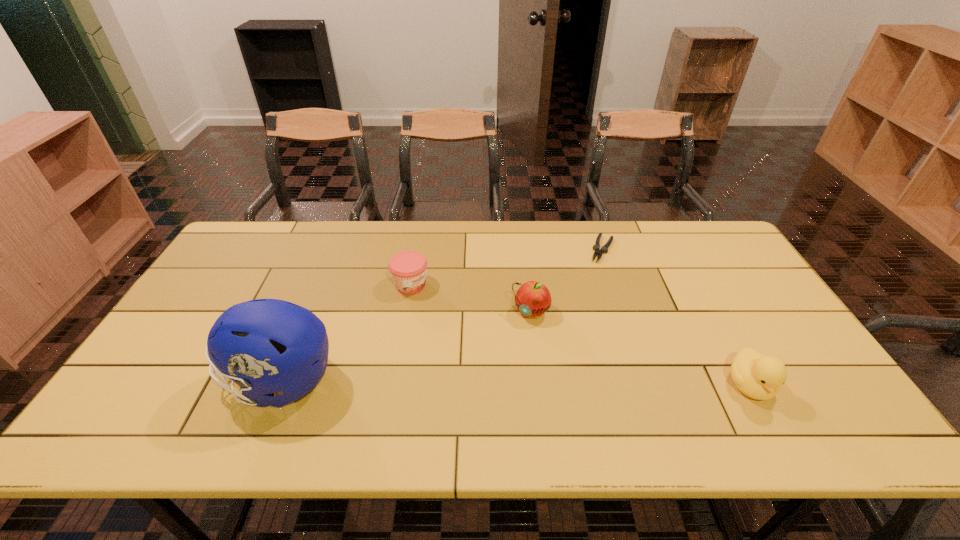
This screenshot has width=960, height=540. In order to click on free region located on the front-facing side of the football helmet in this screenshot , I will do `click(185, 381)`.

Identify the location of blank area located on the front-facing side of the football helmet. This screenshot has height=540, width=960. (194, 381).

Locate an element on the screen. The image size is (960, 540). free space located at the gripping part of the fourth object from left to right is located at coordinates (596, 273).

This screenshot has width=960, height=540. What are the coordinates of `vacant space located 0.160m at the gripping part of the fourth object from left to right` in the screenshot? It's located at (588, 293).

Image resolution: width=960 pixels, height=540 pixels. I want to click on free spot located 0.290m at the gripping part of the fourth object from left to right, so click(x=575, y=322).

Where is `vacant space located 0.150m on the surface of the third object from right to left`? The width and height of the screenshot is (960, 540). vacant space located 0.150m on the surface of the third object from right to left is located at coordinates (492, 360).

Identify the location of vacant area situated 0.250m on the surface of the third object from right to left. 471,388.

Find the location of a particular element. free region located 0.100m on the surface of the third object from right to left is located at coordinates (503, 347).

Image resolution: width=960 pixels, height=540 pixels. What are the coordinates of `vacant space located on the front label of the fourth nearest object` in the screenshot? It's located at (501, 341).

At what (x,y) coordinates should I click in order to perform the action: click on free space located 0.070m on the front label of the fourth nearest object. Please return your answer as a coordinate pair (x, y). Looking at the image, I should click on (441, 303).